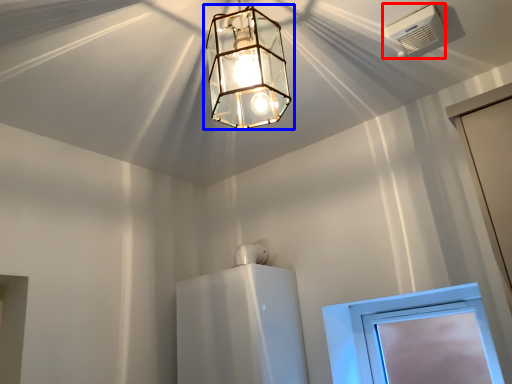
Question: Among these objects, which one is farthest to the camera, air conditioning (highlighted by a red box) or lamp (highlighted by a blue box)?

Choices:
 (A) air conditioning
 (B) lamp

Answer: (A)